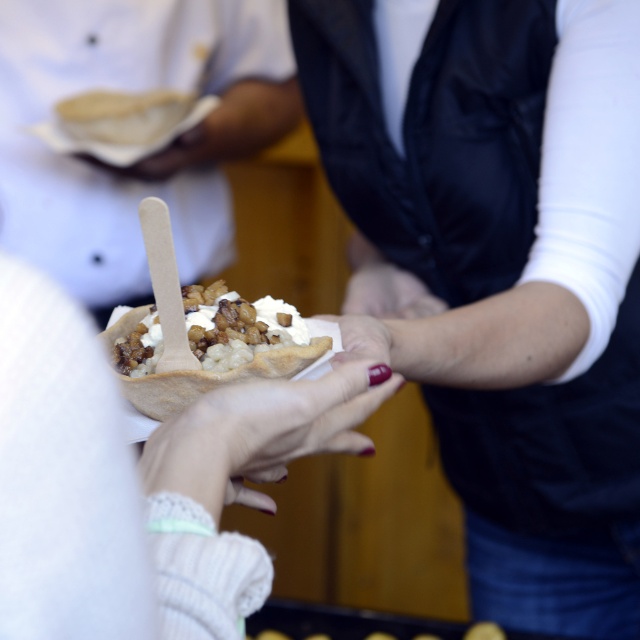
Question: Can you confirm if matte white bowl at center is bigger than white creamy dessert at center?

Choices:
 (A) no
 (B) yes

Answer: (B)

Question: Is white creamy dessert at center smaller than smooth skin hand at center?

Choices:
 (A) yes
 (B) no

Answer: (B)

Question: Which point is farther from the camera taking this photo?

Choices:
 (A) (145, 339)
 (B) (257, 435)

Answer: (A)

Question: Which object is positioned closest to the nail polish at center?

Choices:
 (A) smooth skin hand at center
 (B) matte black vest at center
 (C) matte white bowl at center
 (D) white creamy dessert at center

Answer: (D)

Question: Which point appears farthest from the camera in this image?

Choices:
 (A) (342, 358)
 (B) (356, 301)
 (C) (381, 324)
 (D) (132, 337)

Answer: (B)

Question: Is matte black vest at center bigger than nail polish at center?

Choices:
 (A) yes
 (B) no

Answer: (A)